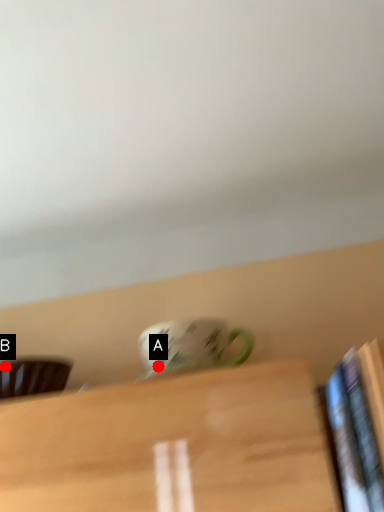
Question: Two points are circled on the image, labeled by A and B beside each circle. Among these points, which one is farthest from the camera?

Choices:
 (A) A is further
 (B) B is further

Answer: (B)